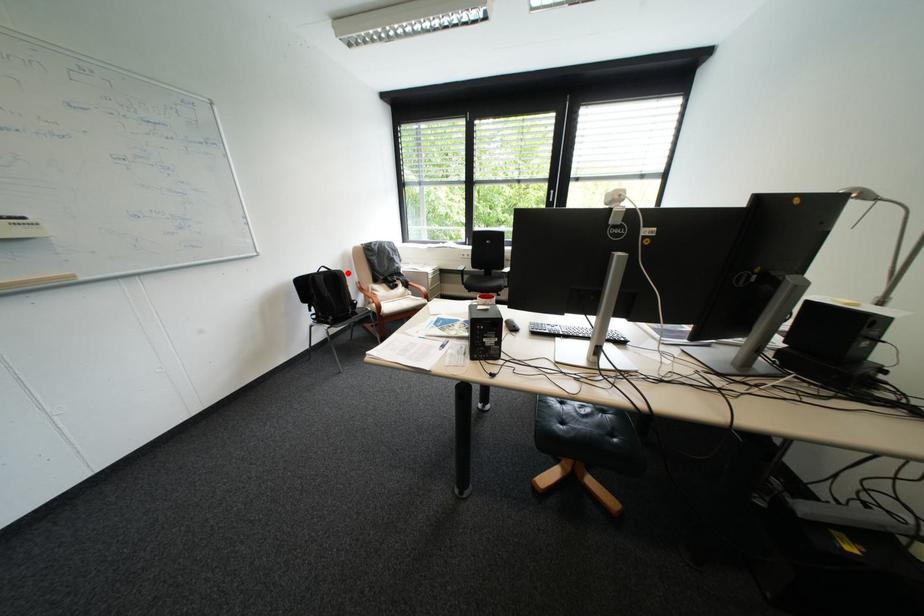
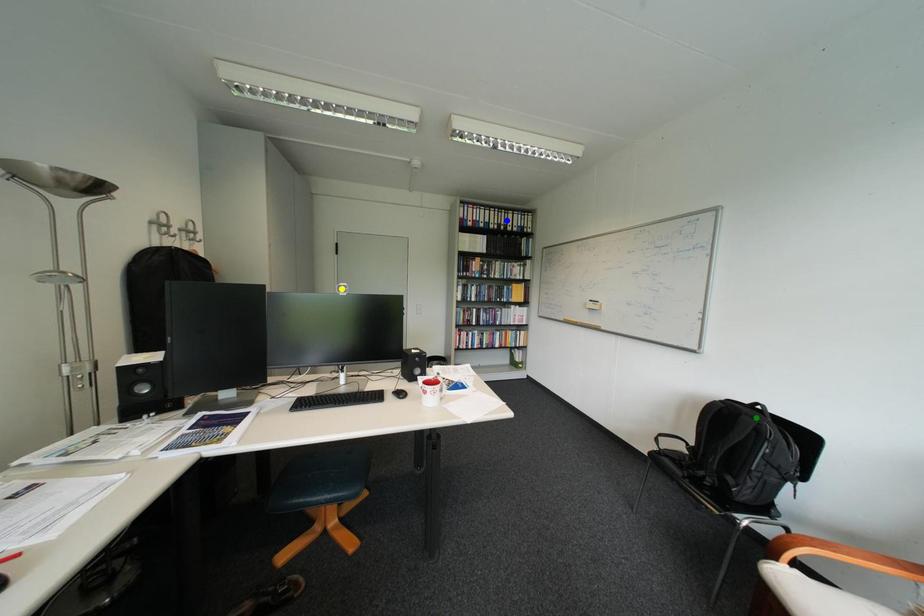
Question: I am providing you with two images of the same scene from different viewpoints. A red point is marked on the first image. You are given multiple points on the second image. Which spot in image 2 lines up with the point in image 1?

Choices:
 (A) yellow point
 (B) green point
 (C) blue point

Answer: (B)